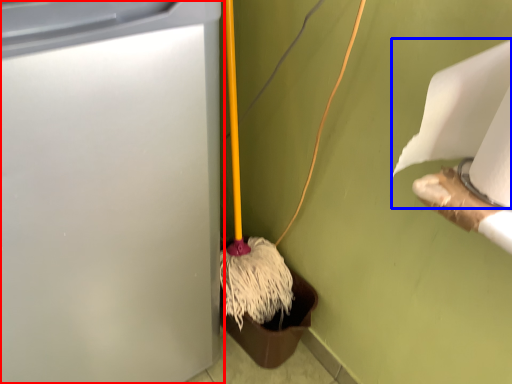
Question: Among these objects, which one is farthest to the camera, waste container (highlighted by a red box) or toilet paper (highlighted by a blue box)?

Choices:
 (A) waste container
 (B) toilet paper

Answer: (B)